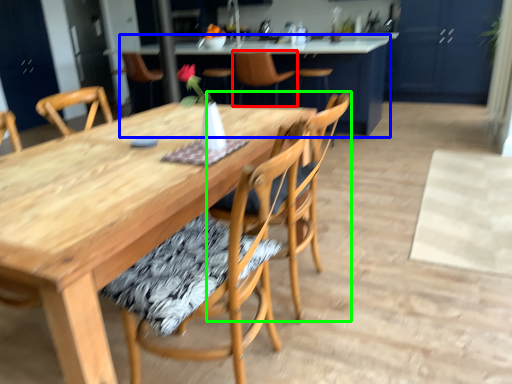
Question: Based on their relative distances, which object is farther from chair (highlighted by a red box)? Choose from table (highlighted by a blue box) and chair (highlighted by a green box).

Choices:
 (A) table
 (B) chair

Answer: (B)